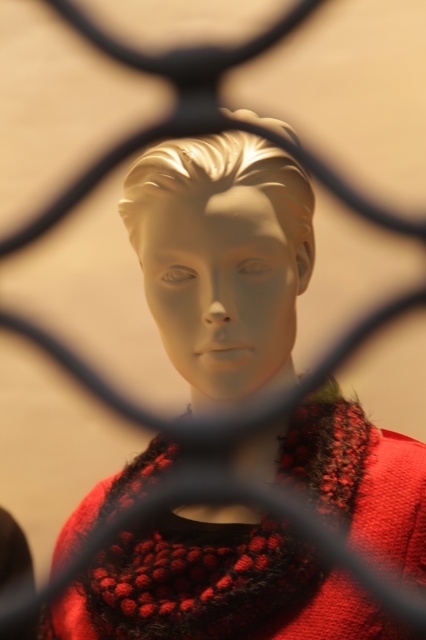
From the picture: You are an art curator preparing an exhibition. You have a matte white head at center and a knitted wool scarf at center displayed behind a black wire mesh fence. Which object would you need to adjust the lighting to ensure visibility, considering their size difference?

The matte white head at center has a smaller size compared to the knitted wool scarf at center, so adjusting the lighting to focus more on the smaller matte white head at center would ensure both are visible.